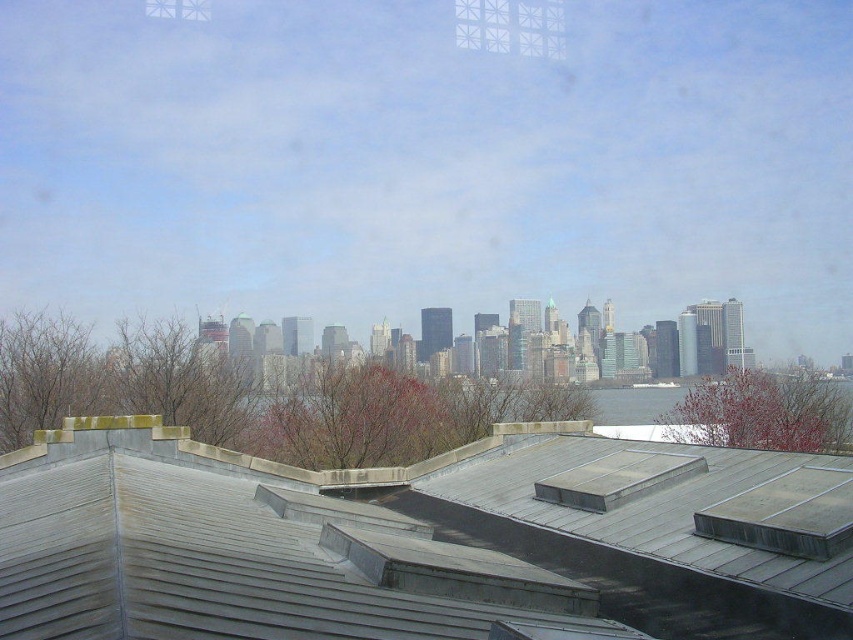
Question: Which point is farther to the camera?

Choices:
 (A) white textured window at upper center
 (B) gray metal roof at center

Answer: (A)

Question: Is the position of gray metal roof at center more distant than that of white textured window at upper center?

Choices:
 (A) no
 (B) yes

Answer: (A)

Question: Observing the image, what is the correct spatial positioning of gray metal roof at center in reference to white textured window at upper center?

Choices:
 (A) above
 (B) below

Answer: (B)

Question: Can you confirm if gray metal roof at center is bigger than white textured window at upper center?

Choices:
 (A) no
 (B) yes

Answer: (A)

Question: Among these objects, which one is nearest to the camera?

Choices:
 (A) gray metal roof at center
 (B) white textured window at upper center

Answer: (A)